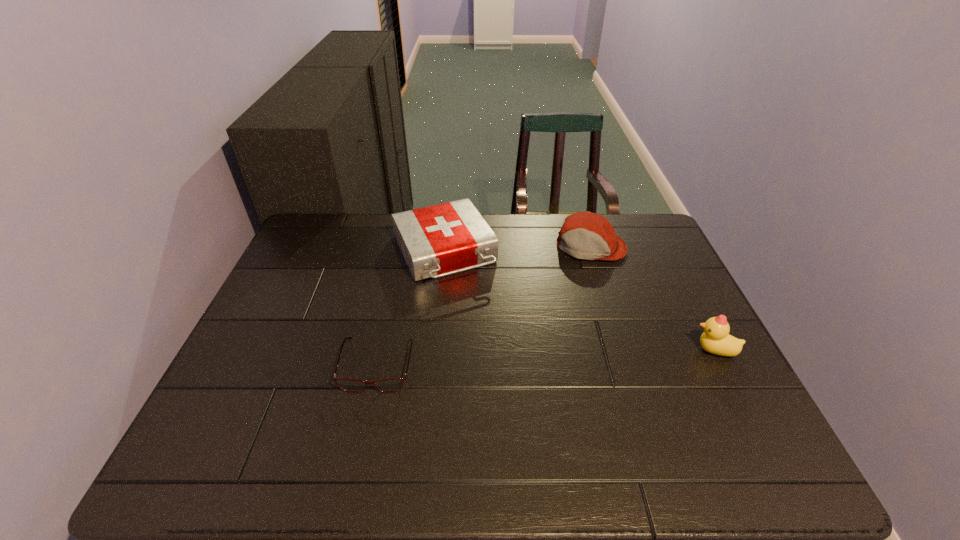
This screenshot has width=960, height=540. Find the location of `the shortest object`. the shortest object is located at coordinates (394, 384).

Identify the location of the rightmost object. The width and height of the screenshot is (960, 540). (715, 339).

Locate an element on the screen. The width and height of the screenshot is (960, 540). cap is located at coordinates (584, 235).

This screenshot has width=960, height=540. In order to click on the first-aid kit in this screenshot , I will do `click(439, 240)`.

The height and width of the screenshot is (540, 960). I want to click on vacant space situated 0.190m on the front-facing side of the rightmost object, so click(x=617, y=350).

The height and width of the screenshot is (540, 960). I want to click on vacant region located 0.130m on the front-facing side of the rightmost object, so click(641, 350).

Identify the location of free point located on the front-facing side of the rightmost object. (637, 350).

Identify the location of free space located 0.270m on the front-facing side of the second object from right to left. pyautogui.click(x=566, y=323).

This screenshot has width=960, height=540. I want to click on free space located on the front-facing side of the second object from right to left, so click(x=580, y=276).

You are a GUI agent. You are given a task and a screenshot of the screen. Output one action in this format:
    pyautogui.click(x=<x>, y=<y>)
    Task: Click on the vacant space located on the front-facing side of the second object from right to left
    The image size is (960, 540).
    Given the screenshot: What is the action you would take?
    pyautogui.click(x=556, y=360)